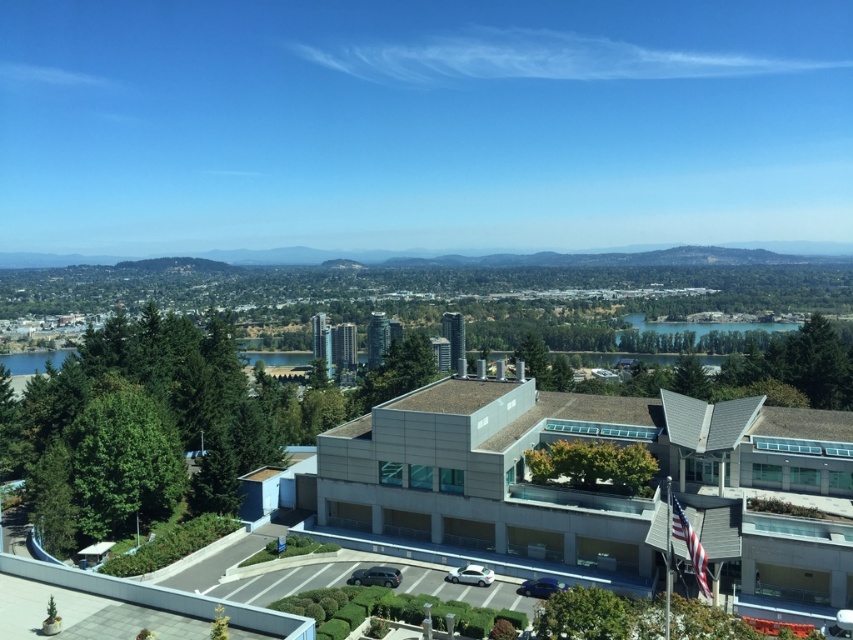
You are standing at the point labeled as point (x=705, y=324) in the image. What is the nearest object to you in the scene?

The nearest object to you at point (x=705, y=324) is the blue glassy lake at center, as the point is located on it.

From the picture: You are standing at the entrance of the multi story building with a flat roof. You want to park your shiny black suv at center in the parking lot. Which direction should you drive to reach the parking lot?

The shiny black suv at center is already parked at the parking lot in front of the building.

You are standing at the entrance of the building and want to take a photo of both the blue glassy lake at center and the glossy blue car at lower center. Which object should you focus on first to ensure both are in the frame?

You should focus on the glossy blue car at lower center first because it is closer to you than the blue glassy lake at center, which is further away. This way, adjusting the camera to include both will be easier starting from the nearer object.